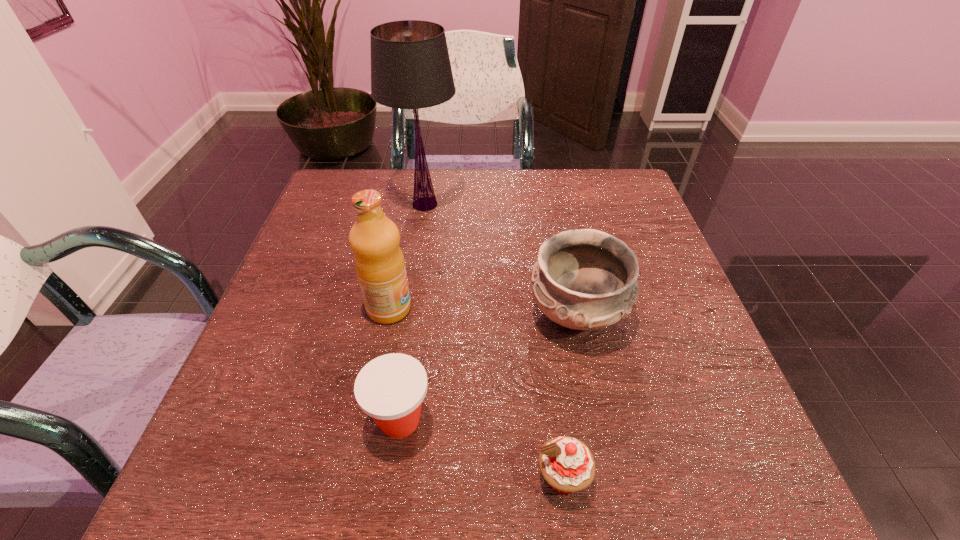
Find the location of `lampshade`. lampshade is located at coordinates (410, 66).

Image resolution: width=960 pixels, height=540 pixels. In order to click on the farthest object in this screenshot , I will do `click(410, 66)`.

Identify the location of the fourth shortest object. The image size is (960, 540). (379, 262).

Locate an element on the screen. pottery is located at coordinates (584, 279).

This screenshot has height=540, width=960. I want to click on Dixie cup, so click(x=390, y=388).

Locate an element on the screen. cupcake is located at coordinates (566, 463).

I want to click on blank space located on the front-facing side of the farthest object, so click(x=605, y=204).

Where is `free space located 0.060m on the front label of the second tallest object`? free space located 0.060m on the front label of the second tallest object is located at coordinates (440, 308).

The width and height of the screenshot is (960, 540). What are the coordinates of `free space located 0.150m on the back of the pottery` in the screenshot? It's located at (561, 238).

Identify the location of blank area located 0.210m on the back of the Dixie cup. The image size is (960, 540). (416, 306).